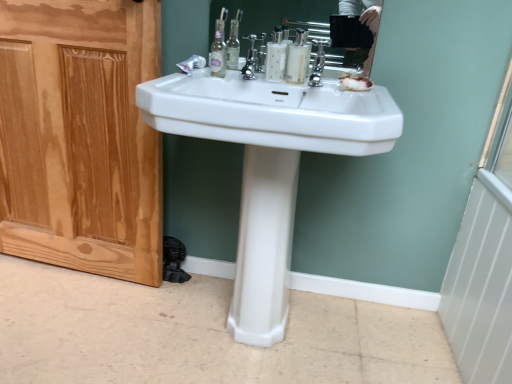
In order to click on unoccupied area in front of natural wood screen door at left in this screenshot , I will do (59, 318).